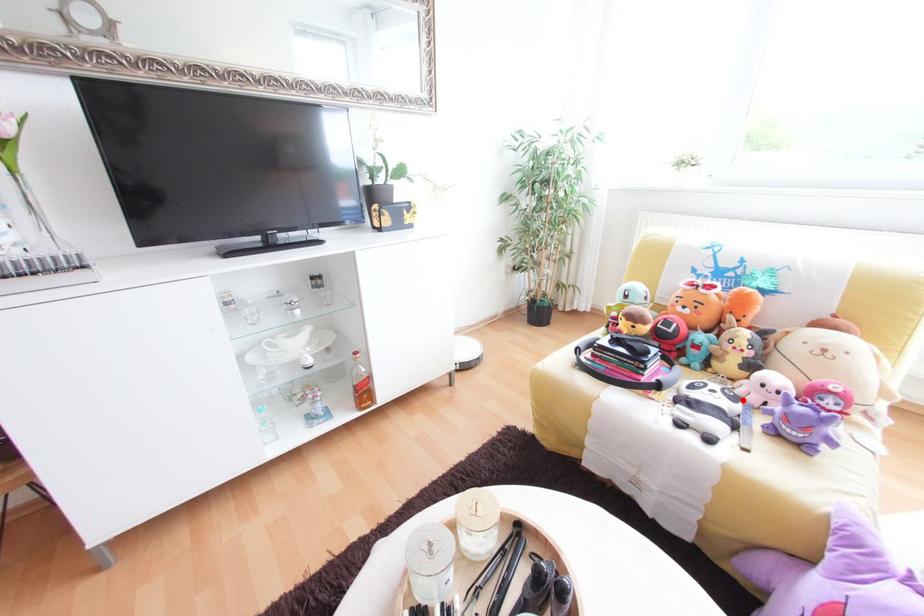
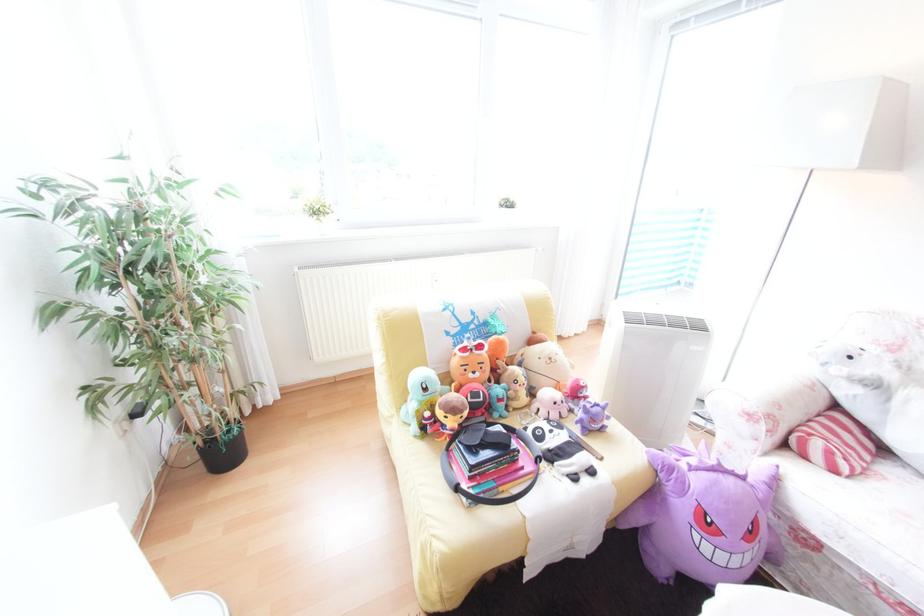
In the second image, find the point that corresponds to the highlighted location in the first image.

(568, 427)